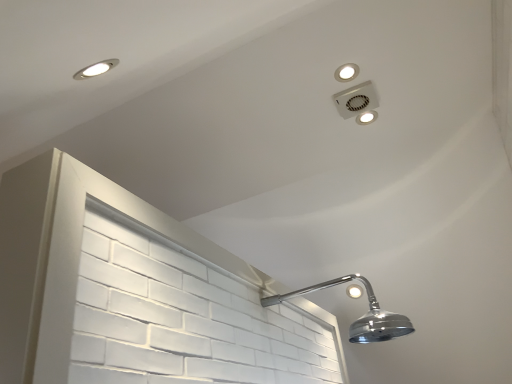
Question: Does matte white light fixture at upper right, the first dot viewed from the right, have a greater width compared to white plastic vent at upper right?

Choices:
 (A) no
 (B) yes

Answer: (A)

Question: Is white plastic vent at upper right at the back of matte white light fixture at upper right, which ranks as the second dot in top-to-bottom order?

Choices:
 (A) yes
 (B) no

Answer: (B)

Question: Is matte white light fixture at upper right, which ranks as the second dot in top-to-bottom order, not inside white plastic vent at upper right?

Choices:
 (A) no
 (B) yes

Answer: (B)

Question: Can white plastic vent at upper right be found inside matte white light fixture at upper right, which is counted as the second dot, starting from the left?

Choices:
 (A) yes
 (B) no

Answer: (B)

Question: Is matte white light fixture at upper right, the 1th dot in the bottom-to-top sequence, positioned before white plastic vent at upper right?

Choices:
 (A) no
 (B) yes

Answer: (A)

Question: Is matte white light fixture at upper right, the second dot when ordered from front to back, far away from white plastic vent at upper right?

Choices:
 (A) yes
 (B) no

Answer: (B)

Question: Can you confirm if white plastic vent at upper right is smaller than white plastic light fixture at upper center, which is the 1th dot in top-to-bottom order?

Choices:
 (A) yes
 (B) no

Answer: (B)

Question: Considering the relative positions of white plastic vent at upper right and white plastic light fixture at upper center, the first dot viewed from the left, in the image provided, is white plastic vent at upper right to the left of white plastic light fixture at upper center, the first dot viewed from the left, from the viewer's perspective?

Choices:
 (A) no
 (B) yes

Answer: (A)

Question: Is white plastic vent at upper right positioned beyond the bounds of white plastic light fixture at upper center, which ranks as the 2th dot in bottom-to-top order?

Choices:
 (A) no
 (B) yes

Answer: (B)

Question: Is white plastic vent at upper right positioned with its back to white plastic light fixture at upper center, which is counted as the 2th dot, starting from the back?

Choices:
 (A) yes
 (B) no

Answer: (B)

Question: Does white plastic vent at upper right have a lesser width compared to white plastic light fixture at upper center, which is counted as the 2th dot, starting from the back?

Choices:
 (A) yes
 (B) no

Answer: (B)

Question: Considering the relative sizes of white plastic vent at upper right and white plastic light fixture at upper center, the 1th dot in the front-to-back sequence, in the image provided, is white plastic vent at upper right bigger than white plastic light fixture at upper center, the 1th dot in the front-to-back sequence,?

Choices:
 (A) yes
 (B) no

Answer: (A)

Question: Considering the relative sizes of matte white light fixture at upper right, which appears as the 1th dot when viewed from the back, and white plastic light fixture at upper center, which ranks as the 2th dot in bottom-to-top order, in the image provided, is matte white light fixture at upper right, which appears as the 1th dot when viewed from the back, thinner than white plastic light fixture at upper center, which ranks as the 2th dot in bottom-to-top order,?

Choices:
 (A) no
 (B) yes

Answer: (B)